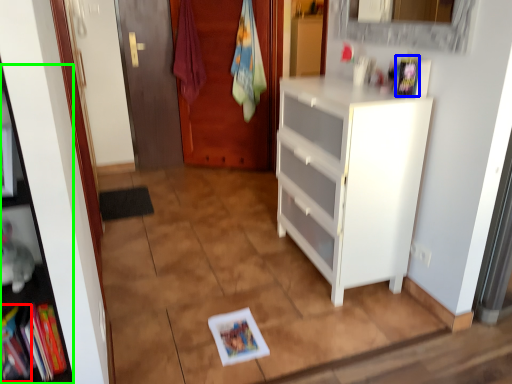
Question: Based on their relative distances, which object is nearer to book (highlighted by a red box)? Choose from book (highlighted by a blue box) and cabinet (highlighted by a green box).

Choices:
 (A) book
 (B) cabinet

Answer: (B)